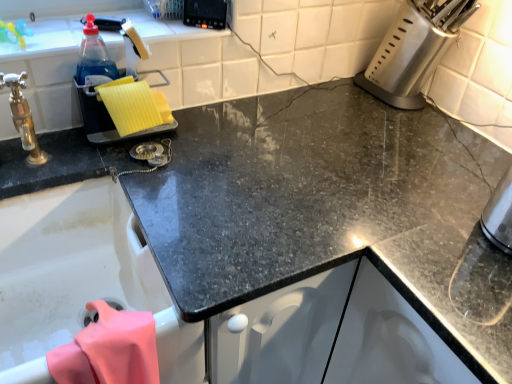
Question: In which direction should I rotate to look at black plastic control panel at upper center, the second appliance positioned from the right?

Choices:
 (A) left
 (B) right

Answer: (A)

Question: Is pink fabric at lower left behind black plastic control panel at upper center, placed as the 2th appliance when sorted from left to right?

Choices:
 (A) yes
 (B) no

Answer: (B)

Question: Does pink fabric at lower left appear on the right side of black plastic control panel at upper center, the second appliance positioned from the right?

Choices:
 (A) yes
 (B) no

Answer: (B)

Question: Is pink fabric at lower left smaller than black plastic control panel at upper center, the second appliance positioned from the right?

Choices:
 (A) yes
 (B) no

Answer: (B)

Question: From a real-world perspective, is pink fabric at lower left physically above black plastic control panel at upper center, the second appliance positioned from the right?

Choices:
 (A) yes
 (B) no

Answer: (B)

Question: From a real-world perspective, is pink fabric at lower left under black plastic control panel at upper center, placed as the 2th appliance when sorted from left to right?

Choices:
 (A) yes
 (B) no

Answer: (A)

Question: Does pink fabric at lower left have a greater height compared to black plastic control panel at upper center, the second appliance positioned from the right?

Choices:
 (A) no
 (B) yes

Answer: (B)

Question: Is the depth of yellow sponge at left, which is the 1th appliance in left-to-right order, greater than that of pink fabric at lower left?

Choices:
 (A) no
 (B) yes

Answer: (B)

Question: From the image's perspective, is yellow sponge at left, marked as the third appliance in a right-to-left arrangement, above pink fabric at lower left?

Choices:
 (A) yes
 (B) no

Answer: (A)

Question: Considering the relative sizes of yellow sponge at left, which is the 1th appliance in left-to-right order, and pink fabric at lower left in the image provided, is yellow sponge at left, which is the 1th appliance in left-to-right order, shorter than pink fabric at lower left?

Choices:
 (A) yes
 (B) no

Answer: (B)

Question: Is yellow sponge at left, which is the 1th appliance in left-to-right order, completely or partially outside of pink fabric at lower left?

Choices:
 (A) no
 (B) yes

Answer: (B)

Question: Is yellow sponge at left, which is the 1th appliance in left-to-right order, wider than pink fabric at lower left?

Choices:
 (A) yes
 (B) no

Answer: (B)

Question: From a real-world perspective, is black plastic control panel at upper center, placed as the 2th appliance when sorted from left to right, positioned under satin silver knife block at upper right, the 1th appliance when ordered from right to left, based on gravity?

Choices:
 (A) no
 (B) yes

Answer: (A)